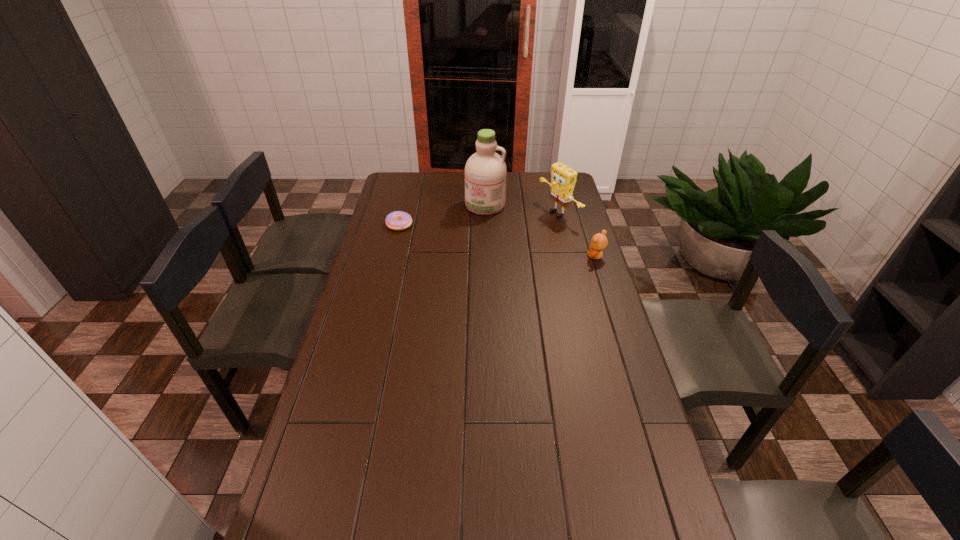
Identify the location of vacant space that satisfies the following two spatial constraints: 1. on the front side of the second object from left to right; 2. on the face of the second shortest object. The width and height of the screenshot is (960, 540). (486, 256).

Image resolution: width=960 pixels, height=540 pixels. Find the location of `vacant region that satisfies the following two spatial constraints: 1. on the front side of the second tallest object; 2. on the face of the nearest object`. vacant region that satisfies the following two spatial constraints: 1. on the front side of the second tallest object; 2. on the face of the nearest object is located at coordinates (569, 256).